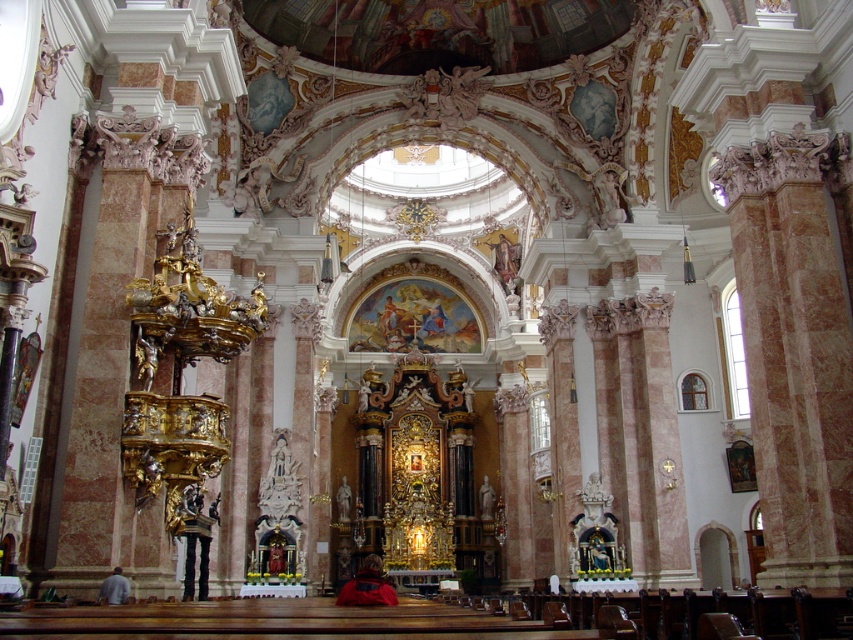
Is point (344, 600) closer to viewer compared to point (106, 593)?

No, it is not.

Can you confirm if red jacket at center is thinner than gray fabric jacket at lower left?

Incorrect, red jacket at center's width is not less than gray fabric jacket at lower left's.

Find the location of `red jacket at center`. red jacket at center is located at coordinates tap(367, 586).